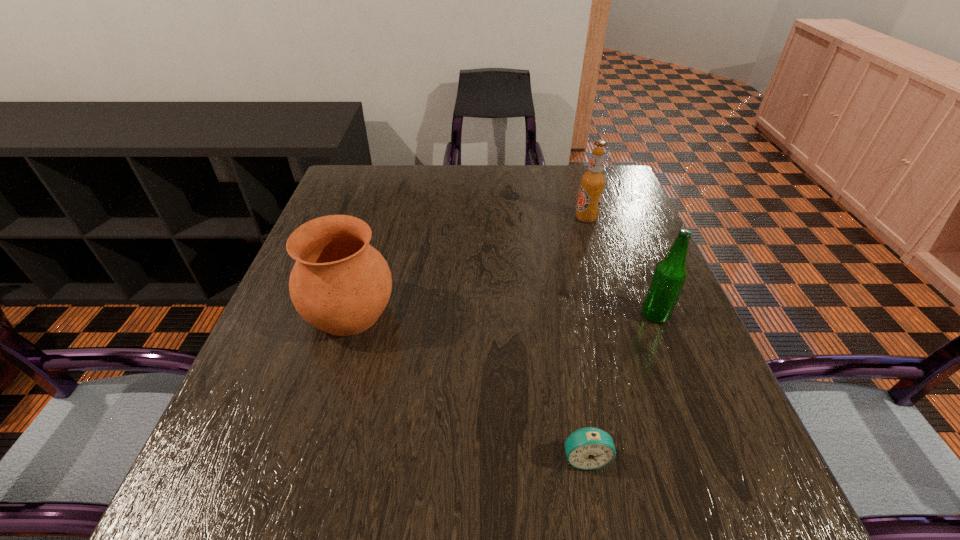
Find the location of `free region located on the label of the rightmost object`. free region located on the label of the rightmost object is located at coordinates (499, 315).

Find the location of a particular element. free space located 0.120m on the label of the rightmost object is located at coordinates (585, 315).

You are a GUI agent. You are given a task and a screenshot of the screen. Output one action in this format:
    pyautogui.click(x=<x>, y=<y>)
    Task: Click on the vacant space positioned 0.190m on the label of the rightmost object
    Image resolution: width=960 pixels, height=540 pixels.
    Given the screenshot: What is the action you would take?
    pyautogui.click(x=551, y=315)

Locate an element on the screen. This screenshot has width=960, height=540. vacant space located 0.070m on the front of the leftmost object is located at coordinates (330, 379).

You are a GUI agent. You are given a task and a screenshot of the screen. Output one action in this format:
    pyautogui.click(x=<x>, y=<y>)
    Task: Click on the vacant point located 0.090m on the front-facing side of the alarm clock
    The height and width of the screenshot is (540, 960).
    Given the screenshot: What is the action you would take?
    pyautogui.click(x=599, y=535)

You are a GUI agent. You are given a task and a screenshot of the screen. Output one action in this format:
    pyautogui.click(x=<x>, y=<y>)
    Task: Click on the object present at the left edge
    
    Given the screenshot: What is the action you would take?
    pyautogui.click(x=340, y=284)

The height and width of the screenshot is (540, 960). Identify the location of vacant point at the far edge. (522, 191).

The height and width of the screenshot is (540, 960). Identify the location of free point at the near edge. (526, 481).

Image resolution: width=960 pixels, height=540 pixels. Identify the location of vacant space at the right edge of the desktop. (653, 245).

In the image, there is a desktop. What are the coordinates of `vacant space at the near left corner` in the screenshot? It's located at (223, 526).